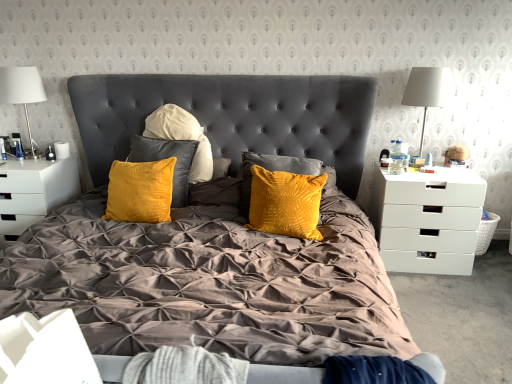
Image resolution: width=512 pixels, height=384 pixels. In order to click on vacant area to the right of clear plastic bottle at right side in this screenshot , I will do `click(411, 169)`.